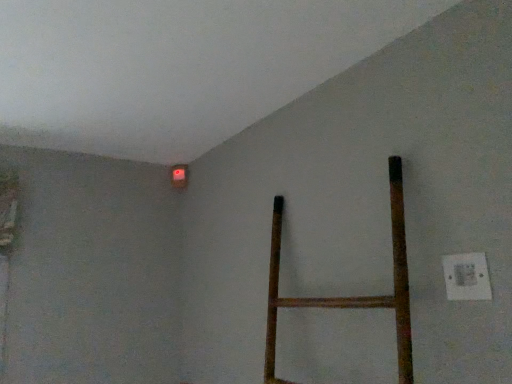
Question: Based on their positions, is matte orange light at upper left located to the left or right of white plastic electric outlet at lower right?

Choices:
 (A) right
 (B) left

Answer: (B)

Question: Relative to white plastic electric outlet at lower right, is matte orange light at upper left in front or behind?

Choices:
 (A) front
 (B) behind

Answer: (B)

Question: Is matte orange light at upper left inside the boundaries of white plastic electric outlet at lower right, or outside?

Choices:
 (A) outside
 (B) inside

Answer: (A)

Question: Is white plastic electric outlet at lower right spatially inside matte orange light at upper left, or outside of it?

Choices:
 (A) inside
 (B) outside

Answer: (B)

Question: In terms of height, does white plastic electric outlet at lower right look taller or shorter compared to matte orange light at upper left?

Choices:
 (A) short
 (B) tall

Answer: (A)

Question: Is point (462, 296) closer or farther from the camera than point (180, 173)?

Choices:
 (A) farther
 (B) closer

Answer: (B)

Question: From the image's perspective, relative to matte orange light at upper left, is white plastic electric outlet at lower right above or below?

Choices:
 (A) below
 (B) above

Answer: (A)